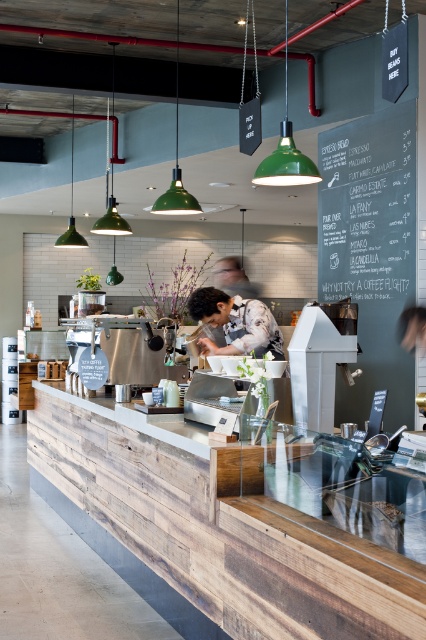
Question: Which of the following is the farthest from the observer?

Choices:
 (A) (406, 193)
 (B) (245, 312)
 (C) (207, 579)

Answer: (A)

Question: Can you confirm if wooden counter at center is positioned to the right of black chalkboard menu at upper right?

Choices:
 (A) yes
 (B) no

Answer: (B)

Question: From the image, what is the correct spatial relationship of wooden counter at center in relation to black chalkboard menu at upper right?

Choices:
 (A) left
 (B) right

Answer: (A)

Question: Is wooden counter at center thinner than matte black shirt at center?

Choices:
 (A) no
 (B) yes

Answer: (A)

Question: Based on their relative distances, which object is farther from the wooden counter at center?

Choices:
 (A) matte black shirt at center
 (B) black chalkboard menu at upper right

Answer: (B)

Question: Among these objects, which one is nearest to the camera?

Choices:
 (A) black chalkboard menu at upper right
 (B) wooden counter at center

Answer: (B)